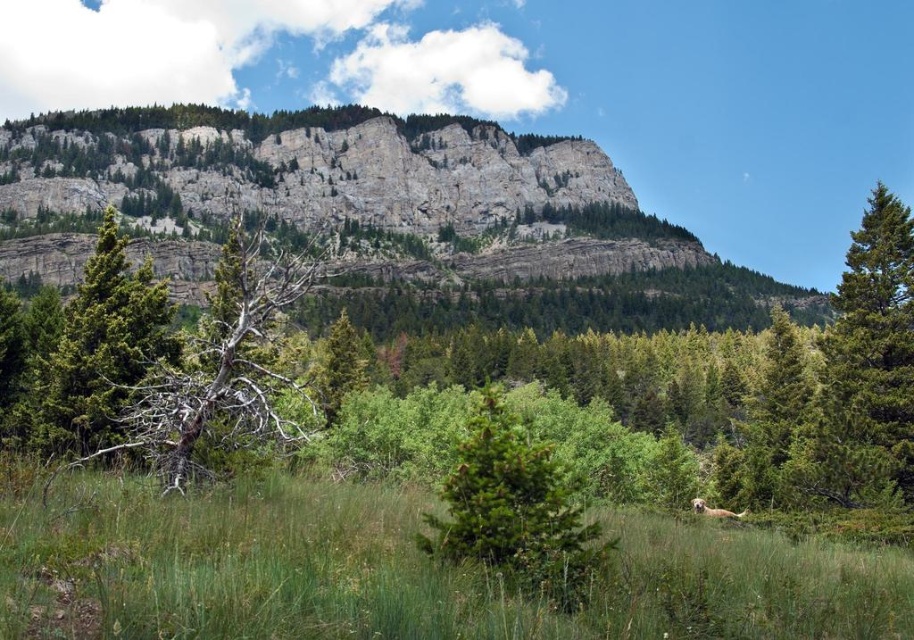
Which is above, gray rock cliff at upper center or green grassy at center?

Positioned higher is gray rock cliff at upper center.

Can you confirm if gray rock cliff at upper center is positioned to the left of green grassy at center?

Correct, you'll find gray rock cliff at upper center to the left of green grassy at center.

Between point (263, 172) and point (742, 552), which one is positioned in front?

Point (742, 552)

Locate an element on the screen. The image size is (914, 640). gray rock cliff at upper center is located at coordinates (376, 216).

Does gray rock cliff at upper center appear over gray bark tree at center-left?

Indeed, gray rock cliff at upper center is positioned over gray bark tree at center-left.

Who is positioned more to the left, gray rock cliff at upper center or gray bark tree at center-left?

gray bark tree at center-left is more to the left.

Is point (344, 116) behind point (232, 428)?

Yes, it is.

You are a GUI agent. You are given a task and a screenshot of the screen. Output one action in this format:
    pyautogui.click(x=<x>, y=<y>)
    Task: Click on the gray rock cliff at upper center
    The height and width of the screenshot is (640, 914).
    Given the screenshot: What is the action you would take?
    pyautogui.click(x=376, y=216)

I want to click on gray rock cliff at upper center, so click(x=376, y=216).

Does point (519, 288) come farther from viewer compared to point (857, 362)?

Yes, point (519, 288) is behind point (857, 362).

Locate an element on the screen. The height and width of the screenshot is (640, 914). gray rock cliff at upper center is located at coordinates click(376, 216).

You are a GUI agent. You are given a task and a screenshot of the screen. Output one action in this format:
    pyautogui.click(x=<x>, y=<y>)
    Task: Click on the gray rock cliff at upper center
    
    Given the screenshot: What is the action you would take?
    pyautogui.click(x=376, y=216)